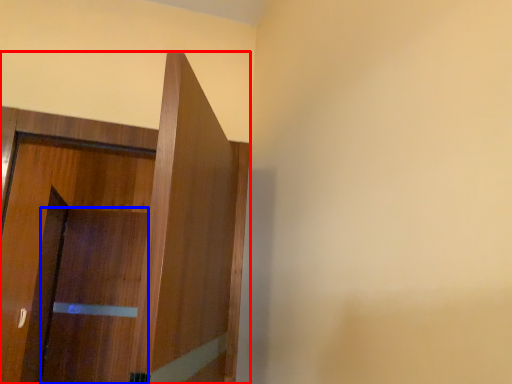
Question: Among these objects, which one is nearest to the camera, door (highlighted by a red box) or screen door (highlighted by a blue box)?

Choices:
 (A) door
 (B) screen door

Answer: (A)